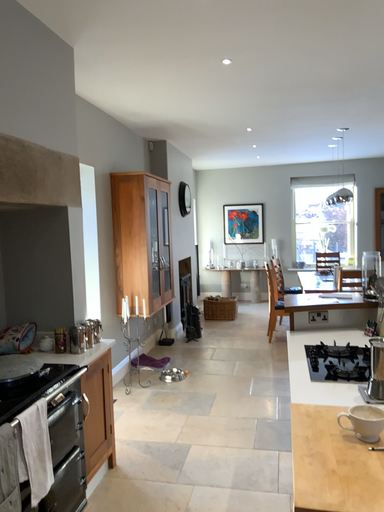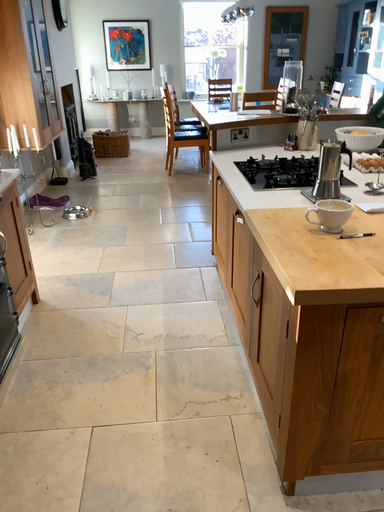
Question: Which way did the camera rotate in the video?

Choices:
 (A) rotated left
 (B) rotated right

Answer: (B)